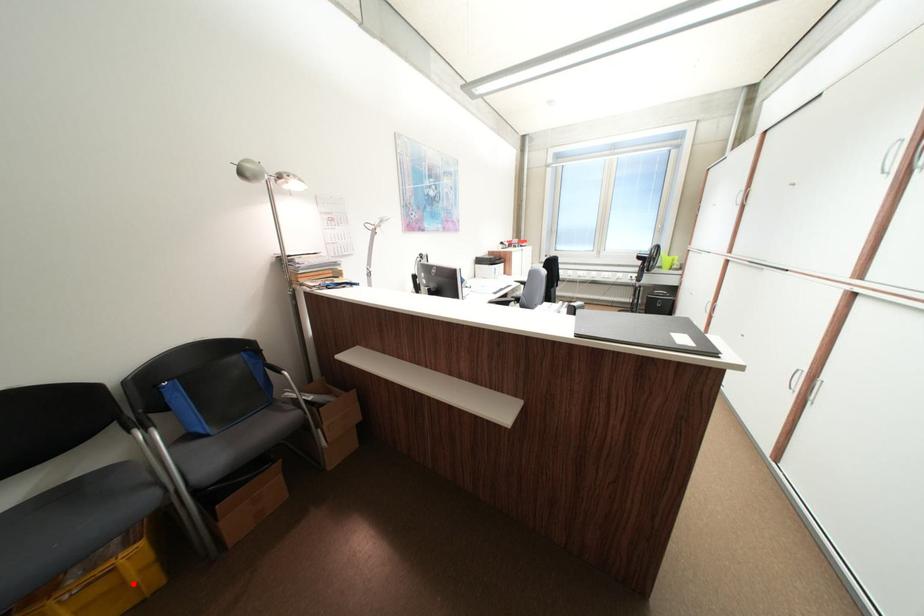
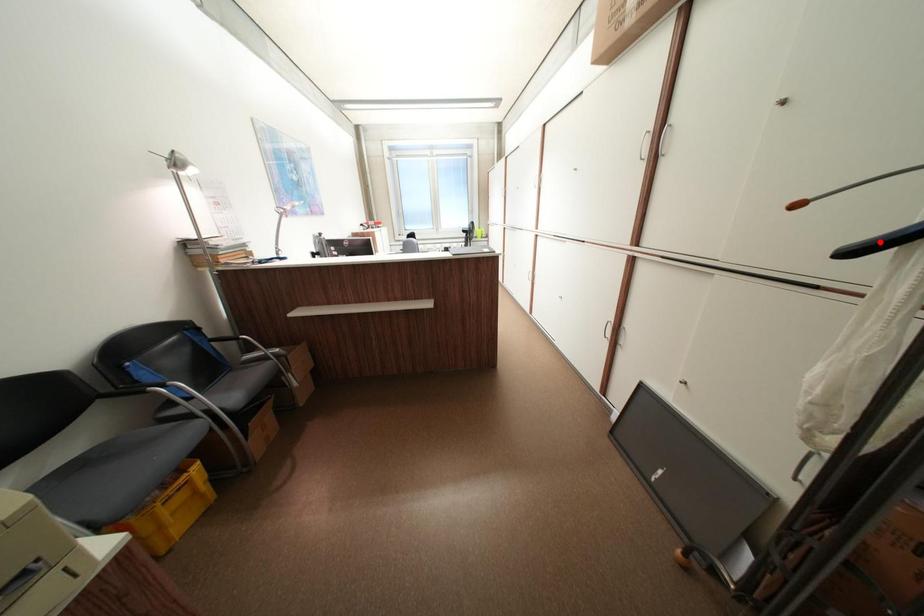
I am providing you with two images of the same scene from different viewpoints. A red point is marked on the first image and another point is marked on the second image. Are the points marked in image1 and image2 representing the same 3D position?

No